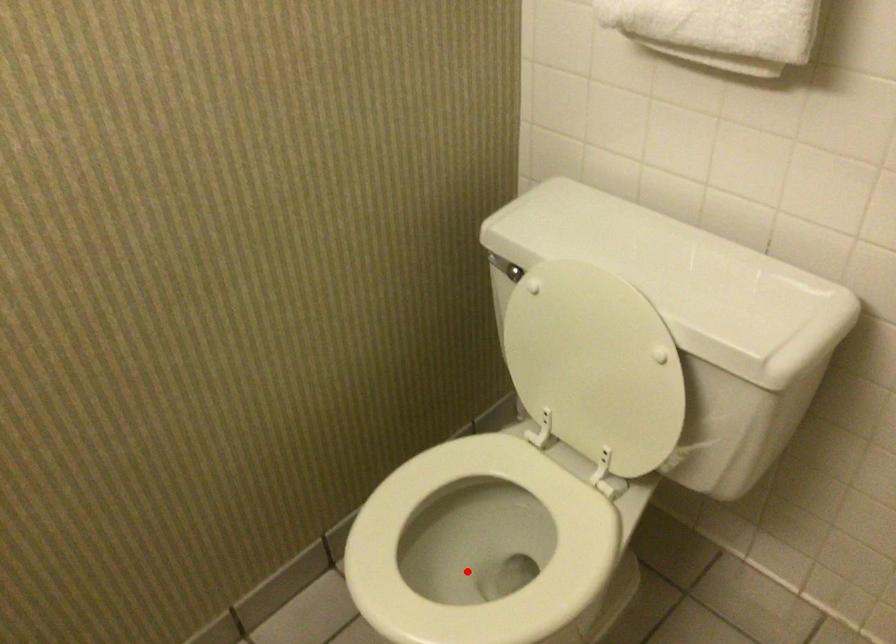
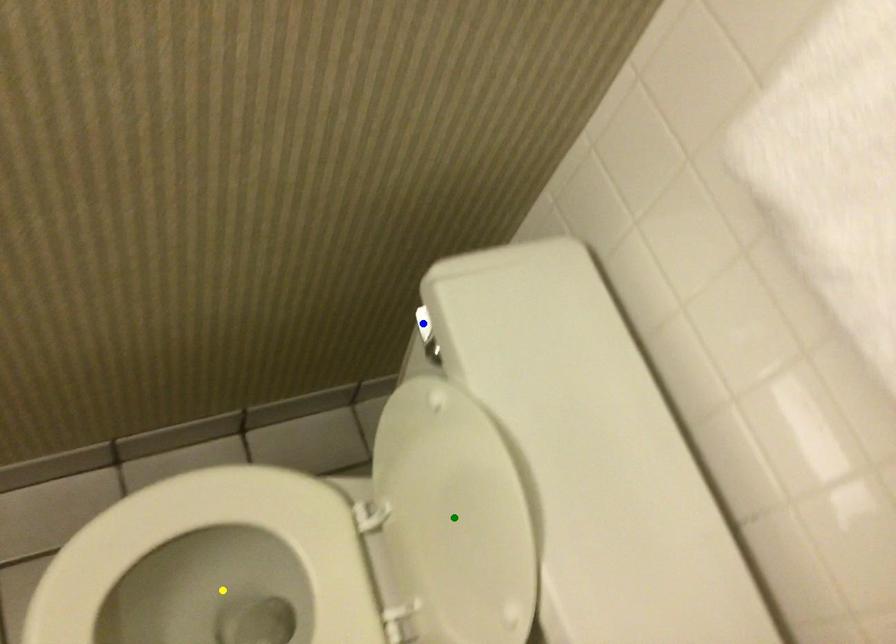
Question: I am providing you with two images of the same scene from different viewpoints. A red point is marked on the first image. You are given multiple points on the second image. Can you choose the point in image 2 that corresponds to the point in image 1?

Choices:
 (A) blue point
 (B) green point
 (C) yellow point

Answer: (C)